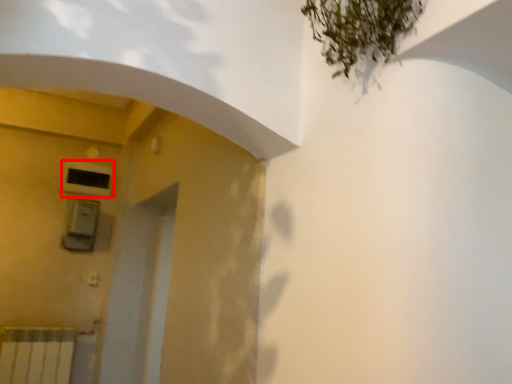
Question: Where is air conditioning (annotated by the red box) located in relation to lift in the image?

Choices:
 (A) right
 (B) left

Answer: (B)